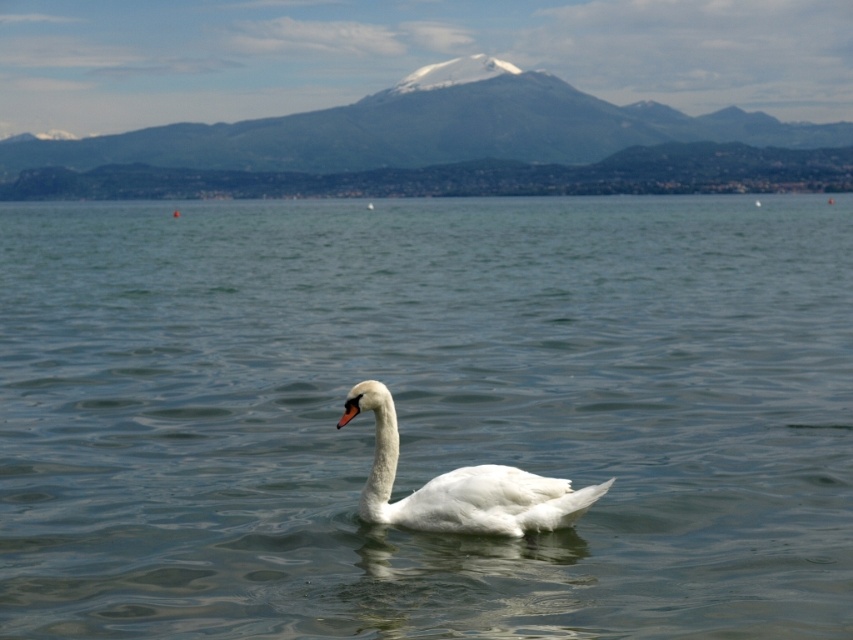
Question: Where is snow-covered mountain at upper center located in relation to white matte swan at center in the image?

Choices:
 (A) above
 (B) below

Answer: (A)

Question: Which of the following is the farthest from the observer?

Choices:
 (A) white matte swan at center
 (B) snow-covered mountain at upper center

Answer: (B)

Question: Which of the following is the farthest from the observer?

Choices:
 (A) (840, 500)
 (B) (403, 99)
 (C) (379, 428)

Answer: (B)

Question: Does clear water at center have a lesser width compared to white matte swan at center?

Choices:
 (A) no
 (B) yes

Answer: (A)

Question: Estimate the real-world distances between objects in this image. Which object is closer to the snow-covered mountain at upper center?

Choices:
 (A) white matte swan at center
 (B) clear water at center

Answer: (B)

Question: Observing the image, what is the correct spatial positioning of clear water at center in reference to snow-covered mountain at upper center?

Choices:
 (A) right
 (B) left

Answer: (A)